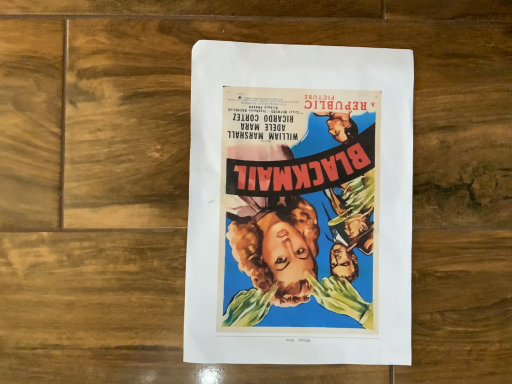
Describe the element at coordinates (298, 205) in the screenshot. I see `vibrant paper poster at center` at that location.

You are a GUI agent. You are given a task and a screenshot of the screen. Output one action in this format:
    pyautogui.click(x=<x>, y=<y>)
    Task: Click on the vibrant paper poster at center
    
    Given the screenshot: What is the action you would take?
    pyautogui.click(x=298, y=205)

Based on the photo, what is the approximate width of vibrant paper poster at center?

11.94 inches.

Where is `vibrant paper poster at center`? This screenshot has width=512, height=384. vibrant paper poster at center is located at coordinates (298, 205).